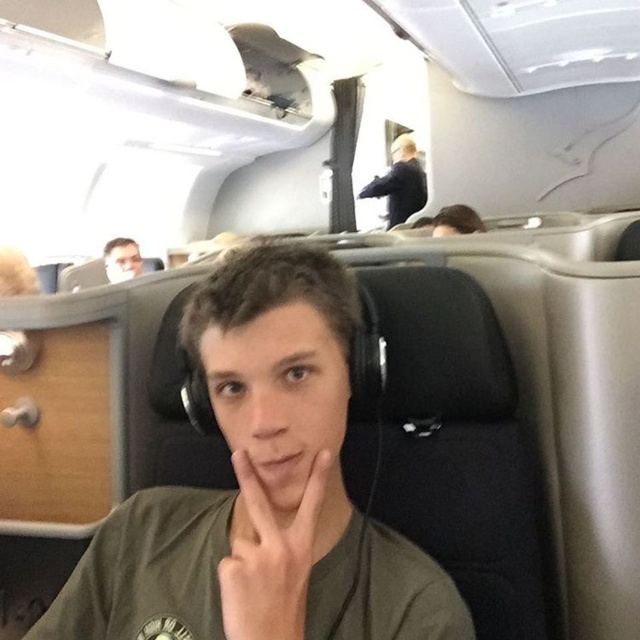
Question: In this image, where is matte green shirt at center located relative to black fabric flight attendant at upper center?

Choices:
 (A) below
 (B) above

Answer: (A)

Question: Does matte green shirt at center have a larger size compared to matte black headphones at upper left?

Choices:
 (A) yes
 (B) no

Answer: (B)

Question: Does matte green shirt at center appear under matte black headphones at upper left?

Choices:
 (A) yes
 (B) no

Answer: (A)

Question: Which of the following is the farthest from the observer?

Choices:
 (A) (276, 589)
 (B) (396, 164)
 (C) (120, 269)
 (D) (282, 252)

Answer: (B)

Question: Based on their relative distances, which object is nearer to the matte green shirt at center?

Choices:
 (A) matte black headphones at upper left
 (B) black fabric flight attendant at upper center
 (C) matte black headphones at center

Answer: (C)

Question: Which of the following is the closest to the observer?

Choices:
 (A) (129, 244)
 (B) (252, 547)
 (C) (300, 547)

Answer: (C)